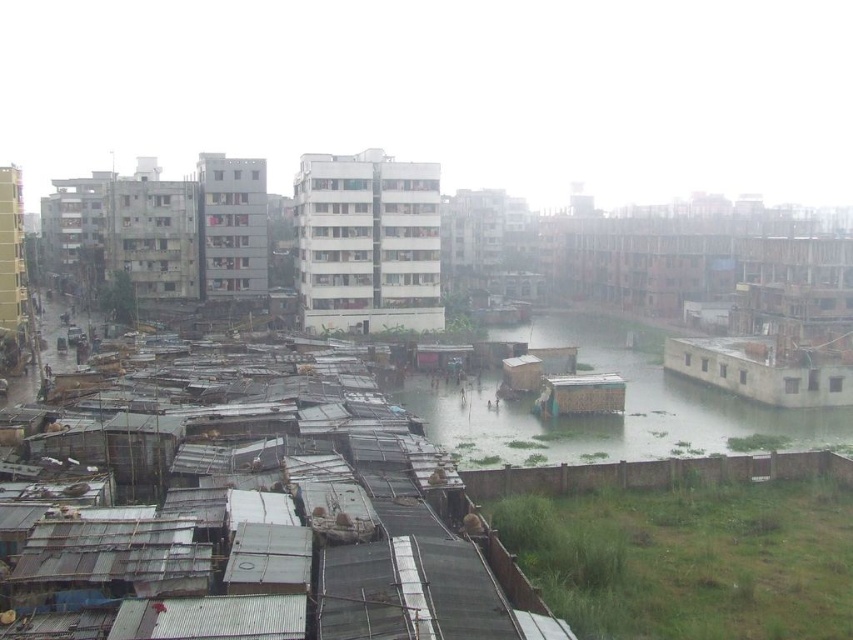
Looking at this image, you are standing at the point labeled as point (607, 416) in the image. What type of terrain are you currently standing on?

The point (607, 416) is on green grassy river at center, so you are standing on a green grassy river.